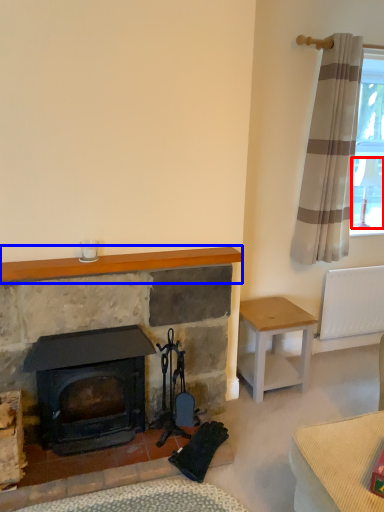
Question: Which point is closer to the camera, lamp (highlighted by a red box) or mantle (highlighted by a blue box)?

Choices:
 (A) lamp
 (B) mantle

Answer: (B)